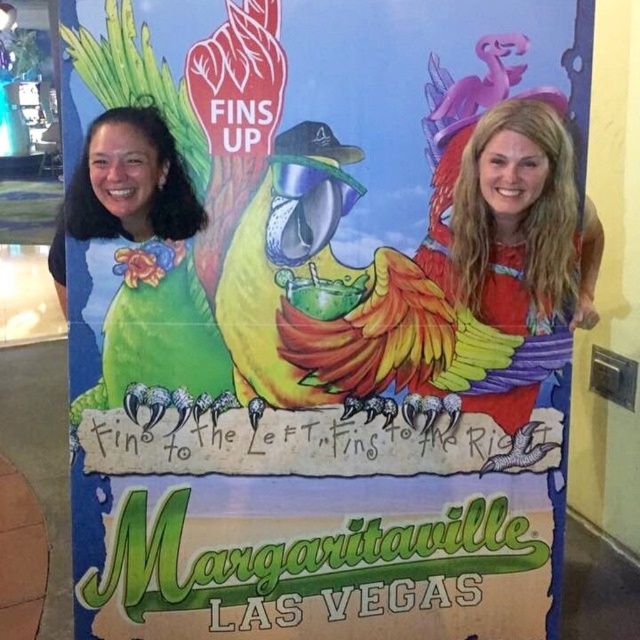
Is shiny metallic parrot at center bigger than blonde hair at right?

No, shiny metallic parrot at center is not bigger than blonde hair at right.

Between shiny metallic parrot at center and blonde hair at right, which one appears on the left side from the viewer's perspective?

shiny metallic parrot at center

Locate an element on the screen. Image resolution: width=640 pixels, height=640 pixels. shiny metallic parrot at center is located at coordinates (362, 308).

In the scene shown: Is blonde hair at right taller than green matte parrot at left?

Yes, blonde hair at right is taller than green matte parrot at left.

Is blonde hair at right bigger than green matte parrot at left?

No.

Describe the element at coordinates (518, 224) in the screenshot. This screenshot has width=640, height=640. I see `blonde hair at right` at that location.

This screenshot has width=640, height=640. What are the coordinates of `blonde hair at right` in the screenshot? It's located at (518, 224).

Who is more forward, (x=314, y=264) or (x=115, y=336)?

Point (x=115, y=336) is in front.

You are a GUI agent. You are given a task and a screenshot of the screen. Output one action in this format:
    pyautogui.click(x=<x>, y=<y>)
    Task: Click on the shiny metallic parrot at center
    This screenshot has height=640, width=640.
    Given the screenshot: What is the action you would take?
    pyautogui.click(x=362, y=308)